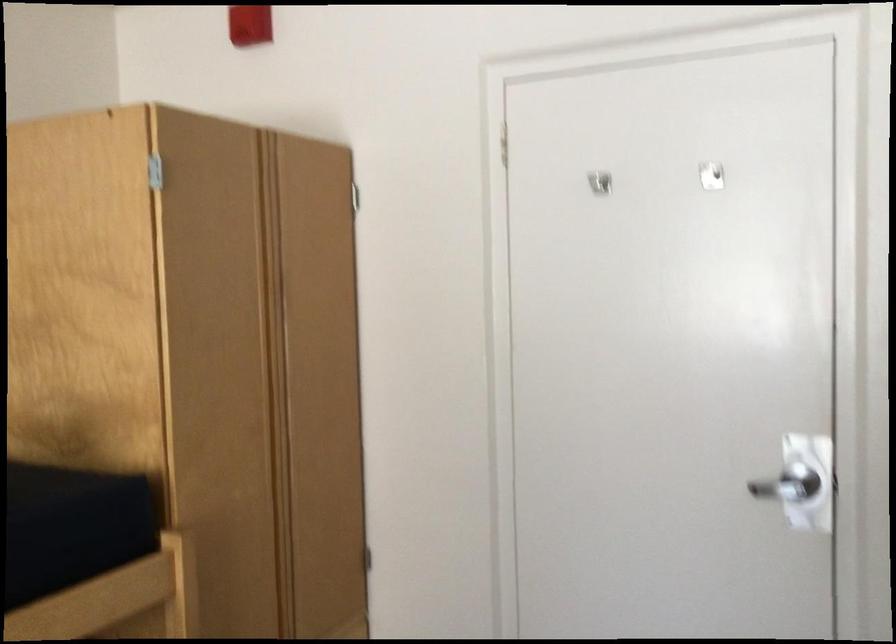
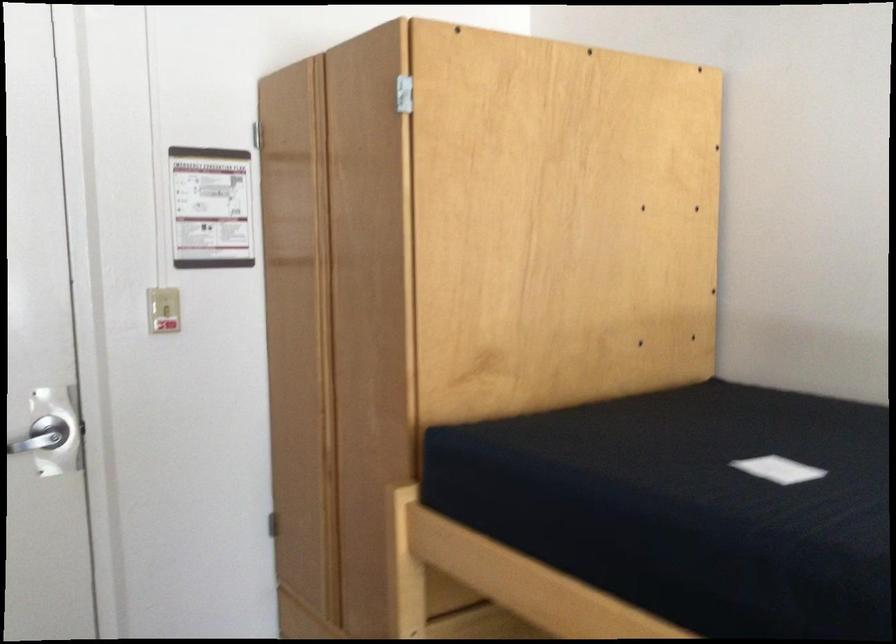
Find the pixel in the second image that matches point (798, 498) in the first image.

(47, 440)